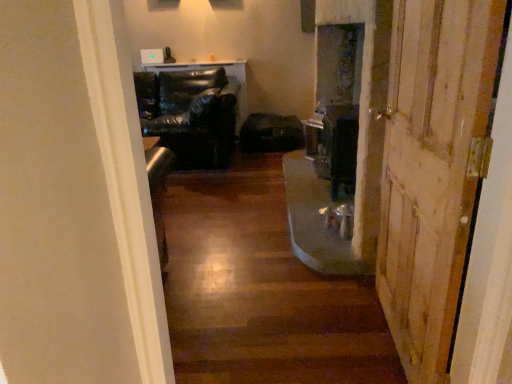
At what (x,y) coordinates should I click in order to perform the action: click on unoccupied space behind wooden door at right. Please return your answer as a coordinate pair (x, y). This screenshot has height=384, width=512. Looking at the image, I should click on (328, 294).